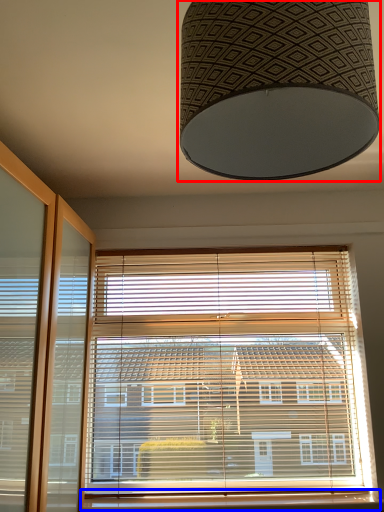
Question: Which object is further to the camera taking this photo, lamp (highlighted by a red box) or window sill (highlighted by a blue box)?

Choices:
 (A) lamp
 (B) window sill

Answer: (B)